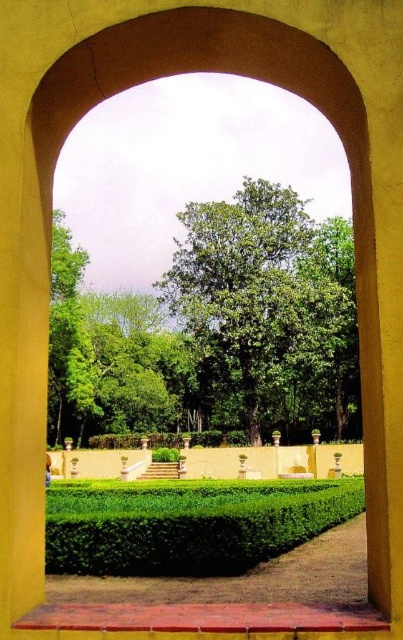
Which is in front, point (110, 486) or point (85, 387)?

Point (110, 486) is in front.

Is point (124, 532) closer to camera compared to point (72, 344)?

Yes, point (124, 532) is in front of point (72, 344).

Locate an element on the screen. Image resolution: width=403 pixels, height=640 pixels. green leafy hedge at center is located at coordinates (188, 524).

Which is in front, point (213, 291) or point (218, 545)?

Point (218, 545) is more forward.

This screenshot has width=403, height=640. Describe the element at coordinates (267, 312) in the screenshot. I see `green leafy tree at center` at that location.

What do you see at coordinates (267, 312) in the screenshot?
I see `green leafy tree at center` at bounding box center [267, 312].

Where is `green leafy tree at center`? The image size is (403, 640). green leafy tree at center is located at coordinates (267, 312).

Who is shorter, green leafy tree at center or green leafy tree at left?

With less height is green leafy tree at center.

Who is more forward, (224, 307) or (51, 371)?

Point (224, 307) is in front.

What do you see at coordinates (267, 312) in the screenshot? Image resolution: width=403 pixels, height=640 pixels. I see `green leafy tree at center` at bounding box center [267, 312].

Where is `green leafy tree at center`? green leafy tree at center is located at coordinates [x=267, y=312].